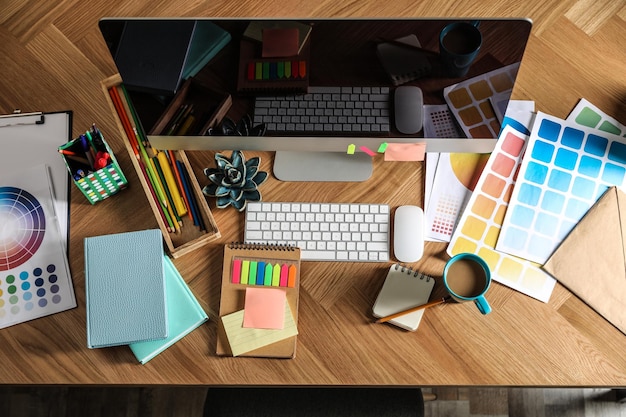
Image resolution: width=626 pixels, height=417 pixels. In order to click on sticky tabs in this screenshot , I will do `click(292, 279)`, `click(282, 277)`, `click(273, 275)`, `click(265, 275)`, `click(255, 279)`, `click(250, 275)`, `click(245, 272)`, `click(233, 272)`.